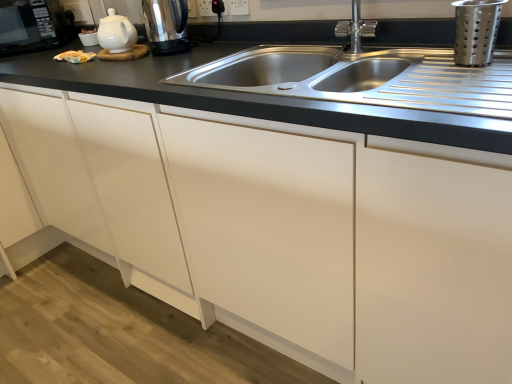
Where is `vacant space positioned to the left of metallic silver strainer at upper right, which is the second appliance in back-to-front order`? This screenshot has height=384, width=512. vacant space positioned to the left of metallic silver strainer at upper right, which is the second appliance in back-to-front order is located at coordinates (418, 73).